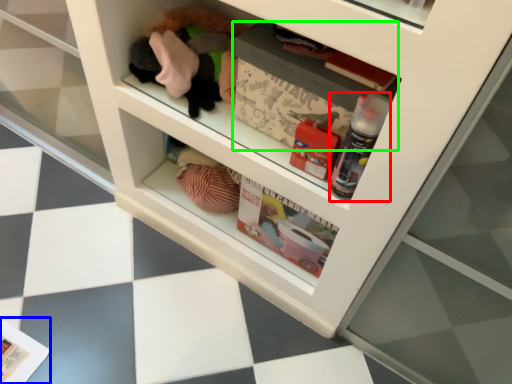
Question: Considering the real-world distances, which object is closest to bottle (highlighted by a red box)? magazine (highlighted by a blue box) or magazine (highlighted by a green box).

Choices:
 (A) magazine
 (B) magazine

Answer: (B)